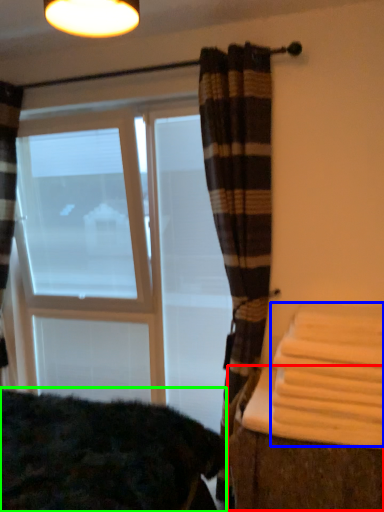
Question: Estimate the real-world distances between objects in this image. Which object is farther from table (highlighted by a red box), bath towel (highlighted by a blue box) or bedding (highlighted by a green box)?

Choices:
 (A) bath towel
 (B) bedding

Answer: (B)